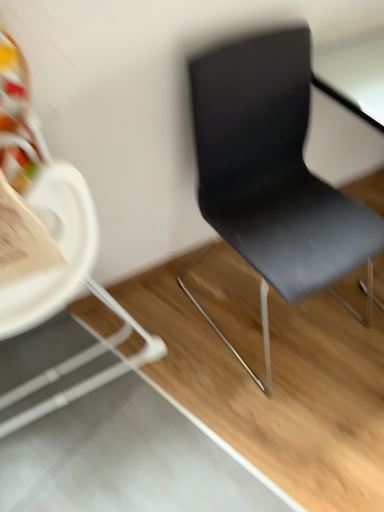
Question: Does matte black chair at right, which ranks as the first chair in left-to-right order, appear on the right side of matte black chair at right, arranged as the first chair when viewed from the right?

Choices:
 (A) no
 (B) yes

Answer: (A)

Question: Considering the relative sizes of matte black chair at right, which ranks as the first chair in left-to-right order, and matte black chair at right, arranged as the first chair when viewed from the right, in the image provided, is matte black chair at right, which ranks as the first chair in left-to-right order, taller than matte black chair at right, arranged as the first chair when viewed from the right,?

Choices:
 (A) no
 (B) yes

Answer: (B)

Question: From the image's perspective, would you say matte black chair at right, which is the second chair in right-to-left order, is shown under matte black chair at right, arranged as the first chair when viewed from the right?

Choices:
 (A) no
 (B) yes

Answer: (B)

Question: Does matte black chair at right, which is the second chair in right-to-left order, come behind matte black chair at right, the second chair positioned from the left?

Choices:
 (A) yes
 (B) no

Answer: (B)

Question: Is matte black chair at right, which is the second chair in right-to-left order, oriented away from matte black chair at right, the second chair positioned from the left?

Choices:
 (A) yes
 (B) no

Answer: (B)

Question: Can you confirm if matte black chair at right, which ranks as the first chair in left-to-right order, is bigger than matte black chair at right, the second chair positioned from the left?

Choices:
 (A) no
 (B) yes

Answer: (B)

Question: From the image's perspective, would you say matte black chair at right, arranged as the first chair when viewed from the right, is positioned over matte black chair at right, which ranks as the first chair in left-to-right order?

Choices:
 (A) no
 (B) yes

Answer: (B)

Question: Does matte black chair at right, arranged as the first chair when viewed from the right, have a lesser height compared to matte black chair at right, which is the second chair in right-to-left order?

Choices:
 (A) no
 (B) yes

Answer: (B)

Question: Is matte black chair at right, which is the second chair in right-to-left order, at the back of matte black chair at right, the second chair positioned from the left?

Choices:
 (A) no
 (B) yes

Answer: (A)

Question: From a real-world perspective, is matte black chair at right, the second chair positioned from the left, under matte black chair at right, which ranks as the first chair in left-to-right order?

Choices:
 (A) no
 (B) yes

Answer: (B)

Question: Is there a large distance between matte black chair at right, the second chair positioned from the left, and matte black chair at right, which is the second chair in right-to-left order?

Choices:
 (A) yes
 (B) no

Answer: (B)

Question: Can you confirm if matte black chair at right, the second chair positioned from the left, is thinner than matte black chair at right, which is the second chair in right-to-left order?

Choices:
 (A) no
 (B) yes

Answer: (A)

Question: In the image, is matte black chair at right, which ranks as the first chair in left-to-right order, positioned in front of or behind matte black chair at right, arranged as the first chair when viewed from the right?

Choices:
 (A) front
 (B) behind

Answer: (A)